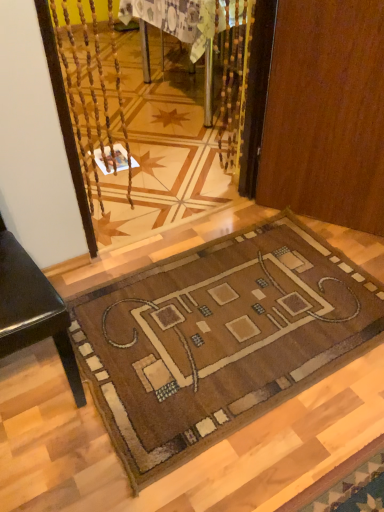
Where is `wooden table at center`? This screenshot has height=512, width=384. wooden table at center is located at coordinates tap(183, 19).

Is wooden table at center taller than brown woven mat at lower center?

Yes, wooden table at center is taller than brown woven mat at lower center.

From a real-world perspective, is wooden table at center located higher than brown woven mat at lower center?

Yes.

Is wooden table at center oriented away from brown woven mat at lower center?

wooden table at center is not turned away from brown woven mat at lower center.

Which is behind, wooden table at center or brown woven mat at lower center?

wooden table at center is behind.

Is brown wood door at center aimed at wooden table at center?

No, brown wood door at center is not oriented towards wooden table at center.

From the image's perspective, is brown wood door at center located above or below wooden table at center?

brown wood door at center is below wooden table at center.

Does brown wood door at center appear on the right side of wooden table at center?

Yes, brown wood door at center is to the right of wooden table at center.

Is brown wood door at center smaller than wooden table at center?

Yes, brown wood door at center is smaller than wooden table at center.

From the image's perspective, who appears lower, brown wood door at center or brown woven mat at lower center?

brown woven mat at lower center, from the image's perspective.

Where is `mat in front of the brown wood door at center`? Image resolution: width=384 pixels, height=512 pixels. mat in front of the brown wood door at center is located at coordinates (219, 339).

In the scene shown: Is brown woven mat at lower center inside brown wood door at center?

No, brown woven mat at lower center is not surrounded by brown wood door at center.

Is brown wood door at center aimed at brown woven mat at lower center?

Yes, brown wood door at center is oriented towards brown woven mat at lower center.

Could brown wood door at center be considered to be inside brown woven mat at lower center?

Actually, brown wood door at center is outside brown woven mat at lower center.

Considering the relative positions of brown woven mat at lower center and brown wood door at center in the image provided, is brown woven mat at lower center to the right of brown wood door at center from the viewer's perspective?

No.

From the image's perspective, does brown woven mat at lower center appear higher than brown wood door at center?

No, from the image's perspective, brown woven mat at lower center is not on top of brown wood door at center.

From the picture: Who is more distant, brown woven mat at lower center or wooden table at center?

wooden table at center is behind.

In the image, is brown woven mat at lower center on the left side or the right side of wooden table at center?

brown woven mat at lower center is to the right of wooden table at center.

Which point is more distant from viewer, (255, 380) or (128, 2)?

Positioned behind is point (128, 2).

Considering the points (163, 27) and (311, 3), which point is behind, point (163, 27) or point (311, 3)?

The point (163, 27) is farther.

How many degrees apart are the facing directions of wooden table at center and brown wood door at center?

The facing directions of wooden table at center and brown wood door at center are 32.2 degrees apart.

Which of these two, wooden table at center or brown wood door at center, is thinner?

With smaller width is brown wood door at center.

Find the location of a particular element. The width and height of the screenshot is (384, 512). mat in front of the wooden table at center is located at coordinates (219, 339).

The height and width of the screenshot is (512, 384). Identify the location of table behind the brown wood door at center. (183, 19).

Considering their positions, is wooden table at center positioned closer to brown woven mat at lower center than brown wood door at center?

brown wood door at center.

When comparing their distances from wooden table at center, does brown woven mat at lower center or brown wood door at center seem further?

Among the two, brown woven mat at lower center is located further to wooden table at center.

Considering their positions, is wooden table at center positioned closer to brown wood door at center than brown woven mat at lower center?

Based on the image, brown woven mat at lower center appears to be nearer to brown wood door at center.

Consider the image. Considering their positions, is brown wood door at center positioned further to wooden table at center than brown woven mat at lower center?

The object further to wooden table at center is brown woven mat at lower center.

From the image, which object appears to be farther from brown wood door at center, brown woven mat at lower center or wooden table at center?

wooden table at center is positioned further to the anchor brown wood door at center.

Considering their positions, is brown wood door at center positioned closer to brown woven mat at lower center than wooden table at center?

brown wood door at center is closer to brown woven mat at lower center.

Locate an element on the screen. Image resolution: width=384 pixels, height=512 pixels. door between wooden table at center and brown woven mat at lower center in the vertical direction is located at coordinates (326, 113).